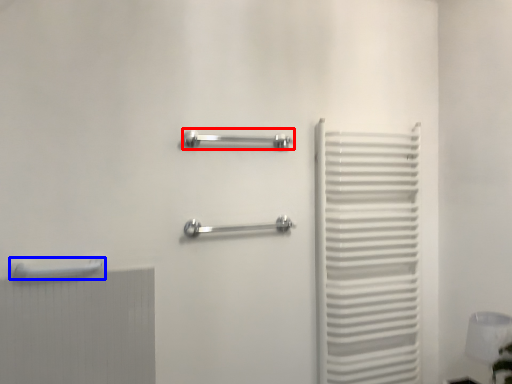
Question: Which object appears farthest to the camera in this image, towel rack (highlighted by a red box) or towel rack (highlighted by a blue box)?

Choices:
 (A) towel rack
 (B) towel rack

Answer: (A)